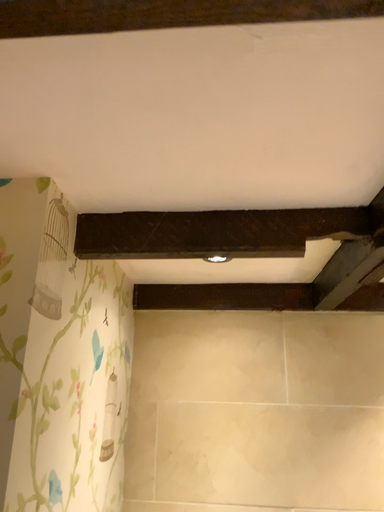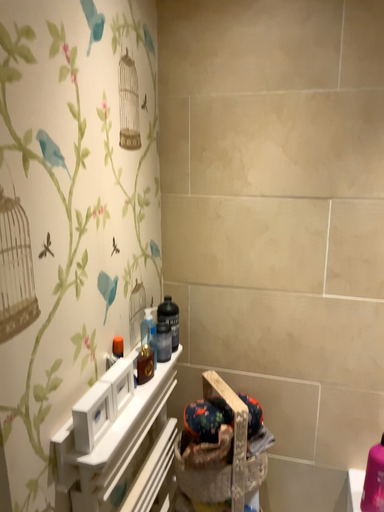
Question: How did the camera likely rotate when shooting the video?

Choices:
 (A) rotated upward
 (B) rotated downward

Answer: (B)